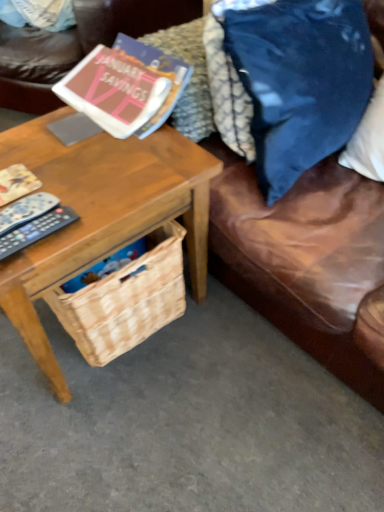
Question: Is woodenobject at left thinner than matte paper book at upper left?

Choices:
 (A) yes
 (B) no

Answer: (B)

Question: Would you say woodenobject at left contains matte paper book at upper left?

Choices:
 (A) no
 (B) yes

Answer: (A)

Question: Considering the relative sizes of woodenobject at left and matte paper book at upper left in the image provided, is woodenobject at left wider than matte paper book at upper left?

Choices:
 (A) no
 (B) yes

Answer: (B)

Question: Does woodenobject at left have a lesser height compared to matte paper book at upper left?

Choices:
 (A) yes
 (B) no

Answer: (B)

Question: From the image's perspective, would you say woodenobject at left is positioned over matte paper book at upper left?

Choices:
 (A) yes
 (B) no

Answer: (B)

Question: Would you say woodenobject at left is a long distance from matte paper book at upper left?

Choices:
 (A) yes
 (B) no

Answer: (B)

Question: Is brown leather couch at lower right turned away from black plastic remote control at left, which is counted as the first remote control, starting from the bottom?

Choices:
 (A) no
 (B) yes

Answer: (A)

Question: Is brown leather couch at lower right at the left side of black plastic remote control at left, which is counted as the first remote control, starting from the bottom?

Choices:
 (A) no
 (B) yes

Answer: (A)

Question: Considering the relative sizes of brown leather couch at lower right and black plastic remote control at left, the second remote control positioned from the top, in the image provided, is brown leather couch at lower right bigger than black plastic remote control at left, the second remote control positioned from the top,?

Choices:
 (A) yes
 (B) no

Answer: (A)

Question: From a real-world perspective, is brown leather couch at lower right located beneath black plastic remote control at left, the second remote control positioned from the top?

Choices:
 (A) yes
 (B) no

Answer: (A)

Question: Would you say black plastic remote control at left, the second remote control positioned from the top, is part of brown leather couch at lower right's contents?

Choices:
 (A) no
 (B) yes

Answer: (A)

Question: Is brown leather couch at lower right taller than black plastic remote control at left, which is counted as the first remote control, starting from the bottom?

Choices:
 (A) no
 (B) yes

Answer: (B)

Question: Can you confirm if matte paper book at upper left is smaller than black plastic remote control at left, which is counted as the first remote control, starting from the bottom?

Choices:
 (A) no
 (B) yes

Answer: (A)